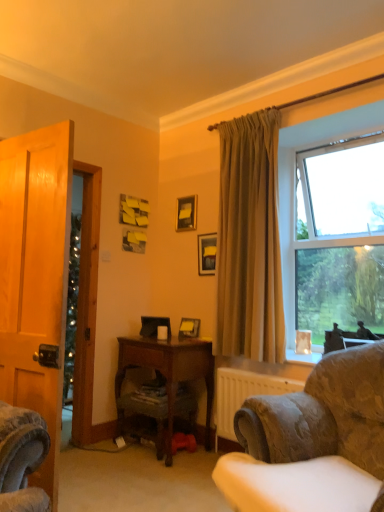
Find the location of a particular element. The width and height of the screenshot is (384, 512). free space in front of matte white coffee cup at center is located at coordinates [x=163, y=344].